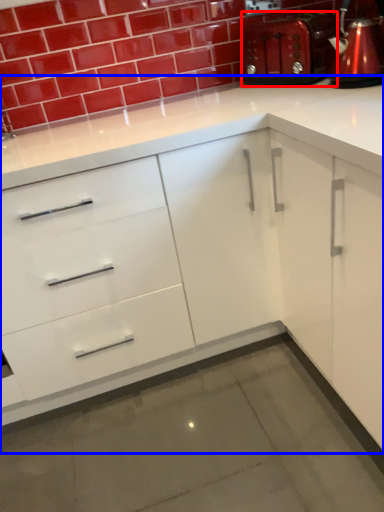
Question: Which point is closer to the camera, appliance (highlighted by a red box) or cabinetry (highlighted by a blue box)?

Choices:
 (A) appliance
 (B) cabinetry

Answer: (B)